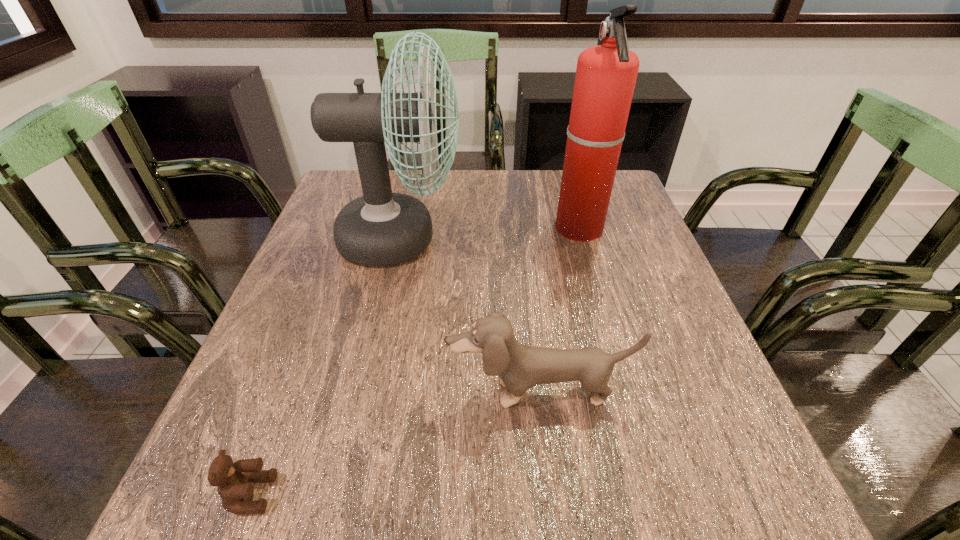
Find the location of a particular element. This screenshot has width=960, height=540. vacant space located at the face of the puppy is located at coordinates (551, 499).

I want to click on vacant region located on the face of the teddy bear, so click(x=380, y=494).

Locate an element on the screen. This screenshot has width=960, height=540. fire extinguisher present at the far edge is located at coordinates (606, 74).

I want to click on fan present at the far edge, so click(x=381, y=228).

This screenshot has width=960, height=540. What are the coordinates of `object that is positioned at the near edge` in the screenshot? It's located at (235, 480).

Where is `fan that is at the left edge`? Image resolution: width=960 pixels, height=540 pixels. fan that is at the left edge is located at coordinates (381, 228).

You are a GUI agent. You are given a task and a screenshot of the screen. Output one action in this format:
    pyautogui.click(x=<x>, y=<y>)
    Task: Click on the teddy bear that is positioned at the left edge
    
    Given the screenshot: What is the action you would take?
    pyautogui.click(x=235, y=480)

Identify the location of object that is at the right edge. (606, 74).

The image size is (960, 540). What are the coordinates of `object situated at the far left corner` in the screenshot? It's located at (381, 228).

I want to click on object that is at the near left corner, so click(235, 480).